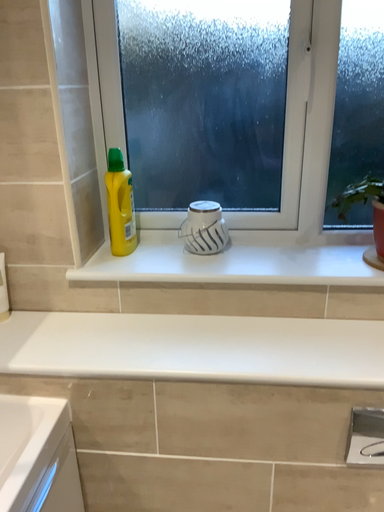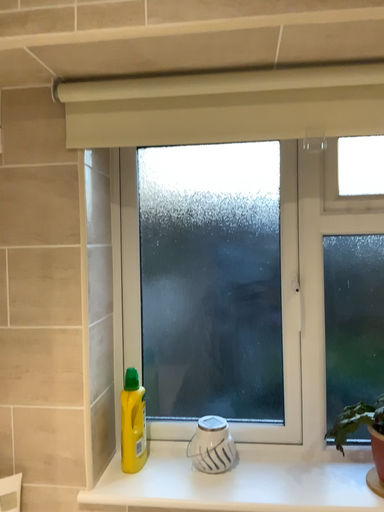
Question: Which way did the camera rotate in the video?

Choices:
 (A) rotated upward
 (B) rotated downward

Answer: (A)